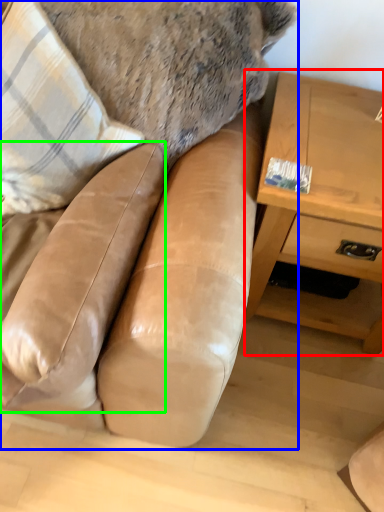
Question: Based on their relative distances, which object is nearer to table (highlighted by a red box)? Choose from studio couch (highlighted by a blue box) and swivel chair (highlighted by a green box).

Choices:
 (A) studio couch
 (B) swivel chair

Answer: (A)